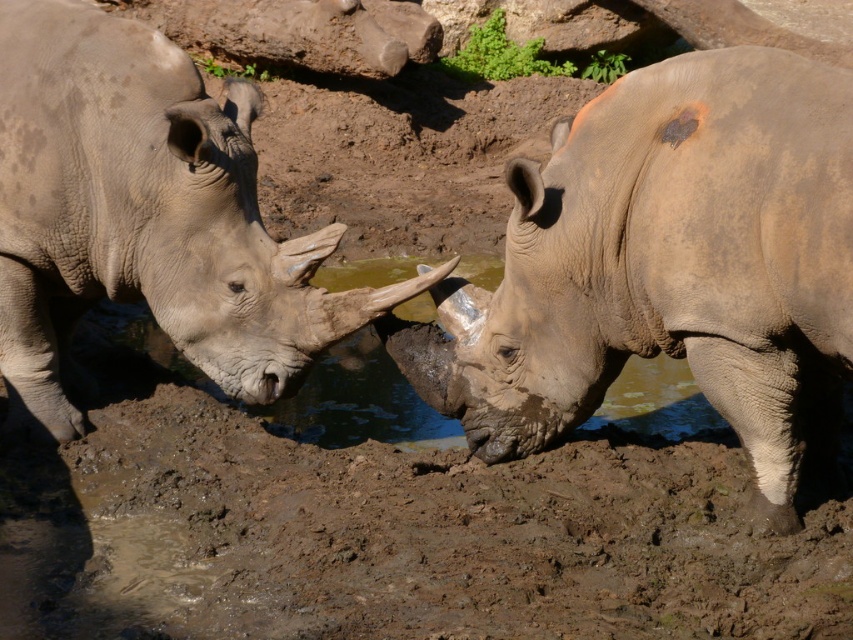
Question: Is gray textured rhino at center closer to camera compared to gray matte rhinoceros at left?

Choices:
 (A) no
 (B) yes

Answer: (B)

Question: Can you confirm if gray textured rhino at center is positioned to the left of gray matte rhinoceros at left?

Choices:
 (A) no
 (B) yes

Answer: (A)

Question: Which object is closer to the camera taking this photo?

Choices:
 (A) gray matte rhinoceros at left
 (B) gray textured rhino at center

Answer: (B)

Question: Which point is farther from the camera taking this photo?

Choices:
 (A) (593, 145)
 (B) (329, 236)

Answer: (B)

Question: Is gray textured rhino at center further to camera compared to gray matte rhinoceros at left?

Choices:
 (A) yes
 (B) no

Answer: (B)